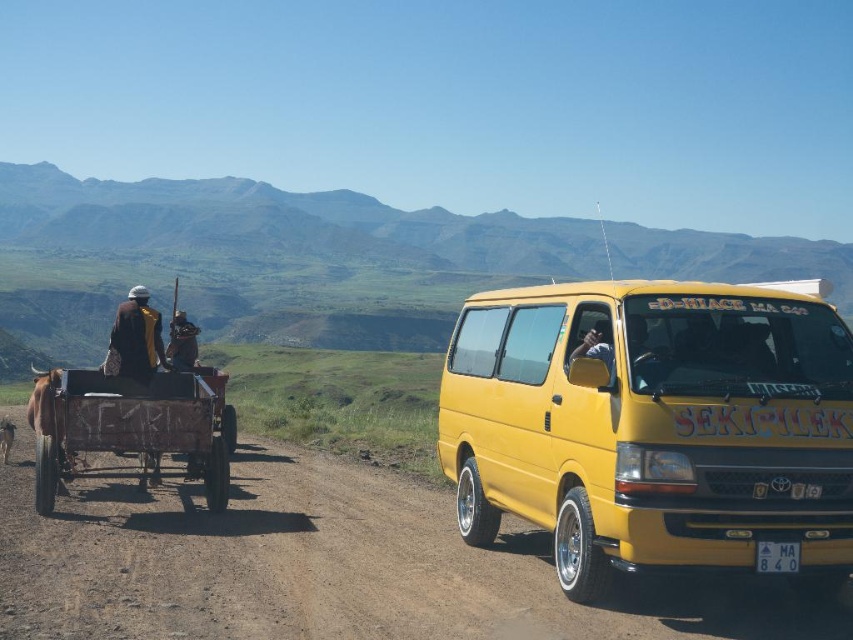
Question: Can you confirm if yellow metallic van at right is positioned above brown leather jacket at left?

Choices:
 (A) yes
 (B) no

Answer: (B)

Question: Which object is closer to the camera taking this photo?

Choices:
 (A) matte black shirt at center
 (B) yellow fabric jacket at left
 (C) yellow metallic van at right
 (D) brown leather jacket at left

Answer: (C)

Question: Can you confirm if brown dirt track at center is bigger than matte black shirt at center?

Choices:
 (A) no
 (B) yes

Answer: (A)

Question: Can you confirm if yellow metallic van at right is positioned to the right of brown leather jacket at left?

Choices:
 (A) yes
 (B) no

Answer: (A)

Question: Estimate the real-world distances between objects in this image. Which object is farther from the brown wooden wagon at left?

Choices:
 (A) yellow fabric jacket at left
 (B) yellow metallic van at right

Answer: (B)

Question: Which object is closer to the camera taking this photo?

Choices:
 (A) brown wooden wagon at left
 (B) brown leather jacket at left

Answer: (A)